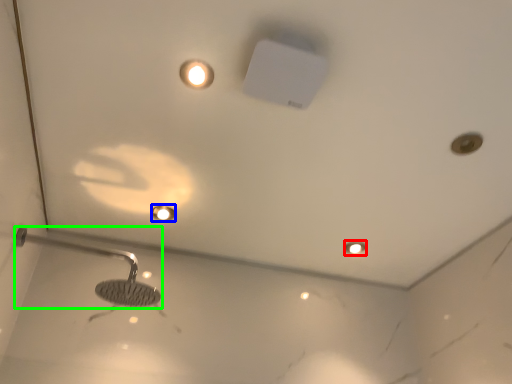
Question: Considering the real-world distances, which object is farthest from light fixture (highlighted by a red box)? droplight (highlighted by a blue box) or shower (highlighted by a green box)?

Choices:
 (A) droplight
 (B) shower

Answer: (B)